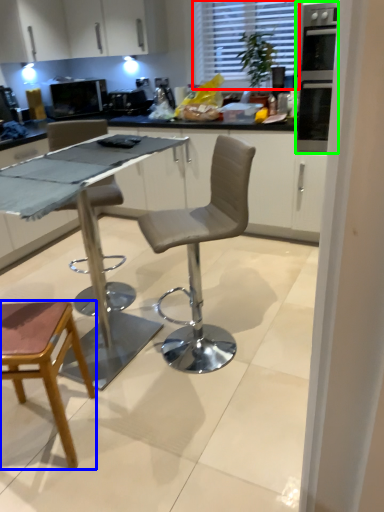
Question: Estimate the real-world distances between objects in this image. Which object is farther from window (highlighted by a red box), chair (highlighted by a blue box) or oven (highlighted by a green box)?

Choices:
 (A) chair
 (B) oven

Answer: (A)